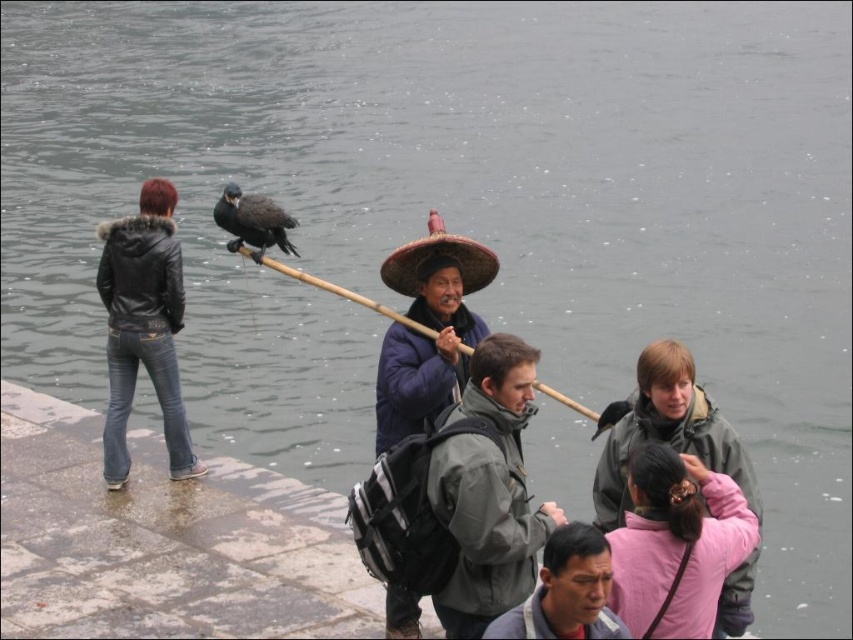
Question: In this image, where is gray fabric jacket at lower center located relative to bamboo stick at center?

Choices:
 (A) below
 (B) above

Answer: (A)

Question: Among these objects, which one is farthest from the camera?

Choices:
 (A) black leather jacket at left
 (B) dark brown feathers at center
 (C) bamboo stick at center
 (D) gray matte jacket at center

Answer: (A)

Question: Estimate the real-world distances between objects in this image. Which object is farther from the gray fabric jacket at lower center?

Choices:
 (A) dark brown feathers at center
 (B) bamboo stick at center
 (C) black leather jacket at left

Answer: (C)

Question: Does gray matte jacket at center appear on the right side of gray fabric jacket at lower center?

Choices:
 (A) yes
 (B) no

Answer: (A)

Question: Is pink fabric hairband at lower right thinner than dark brown feathers at center?

Choices:
 (A) no
 (B) yes

Answer: (B)

Question: Which object is positioned farthest from the bamboo stick at center?

Choices:
 (A) gray fabric jacket at lower center
 (B) gray matte jacket at center
 (C) pink fabric hairband at lower right

Answer: (B)